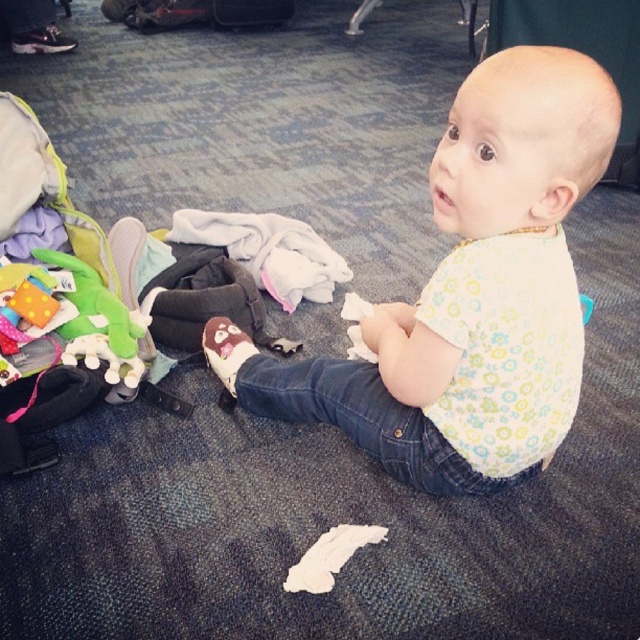
You are a parent trying to organize items around your baby. You need to place a new toy between the white soft cloth at center and the black hard suitcase at center. According to the scene, where should you position the toy to ensure it is between these two items?

The white soft cloth at center is to the right of the black hard suitcase at center, so you should place the new toy to the right of the black hard suitcase at center but to the left of the white soft cloth at center to position it between them.

You are a parent trying to retrieve the white soft cloth at center for your baby. There is a black hard suitcase at center in the way. Can you easily access the cloth without moving the suitcase?

The white soft cloth at center is positioned under the black hard suitcase at center, so you cannot easily access it without moving the suitcase.

You are a parent trying to organize items around your baby. You need to place a pacifier near the white cotton bib at center and a toy near the black hard suitcase at center. Which item should you place closer to the baby?

The pacifier should be placed closer to the baby because the white cotton bib at center is to the right of the black hard suitcase at center, meaning it is closer to the baby.